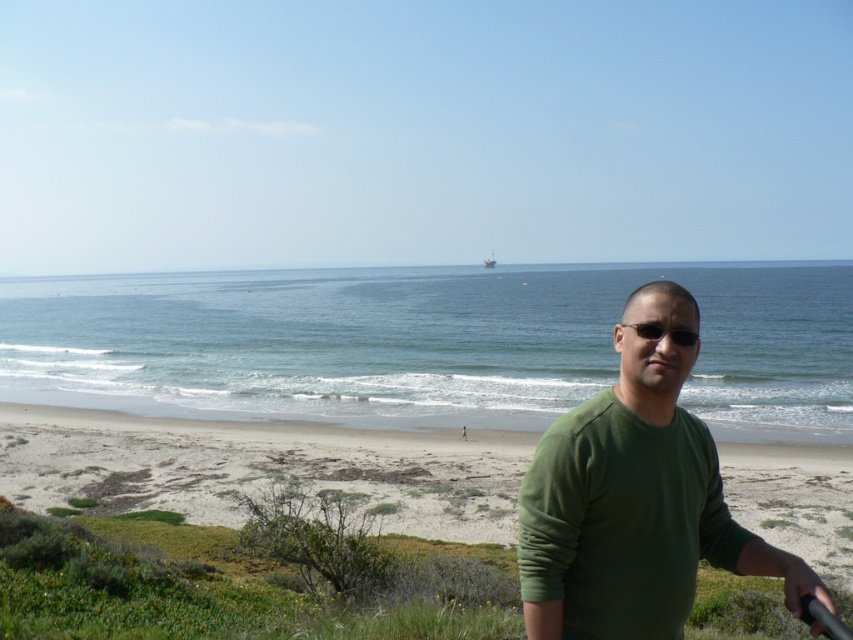
What do you see at coordinates (262, 467) in the screenshot? I see `smooth sand beach at center` at bounding box center [262, 467].

Does smooth sand beach at center lie in front of black plastic sunglasses at center?

No, smooth sand beach at center is behind black plastic sunglasses at center.

At what (x,y) coordinates should I click in order to perform the action: click on smooth sand beach at center. Please return your answer as a coordinate pair (x, y). Looking at the image, I should click on (262, 467).

Consider the image. Does green matte sweater at center have a smaller size compared to black plastic sunglasses at center?

No, green matte sweater at center is not smaller than black plastic sunglasses at center.

Is green matte sweater at center below black plastic sunglasses at center?

Indeed, green matte sweater at center is positioned under black plastic sunglasses at center.

Describe the element at coordinates (634, 499) in the screenshot. I see `green matte sweater at center` at that location.

Identify the location of green matte sweater at center. (634, 499).

Can you confirm if smooth sand beach at center is positioned to the left of green matte sweater at center?

Yes, smooth sand beach at center is to the left of green matte sweater at center.

Does smooth sand beach at center come in front of green matte sweater at center?

No, it is not.

This screenshot has height=640, width=853. Find the location of `smooth sand beach at center`. smooth sand beach at center is located at coordinates coord(262,467).